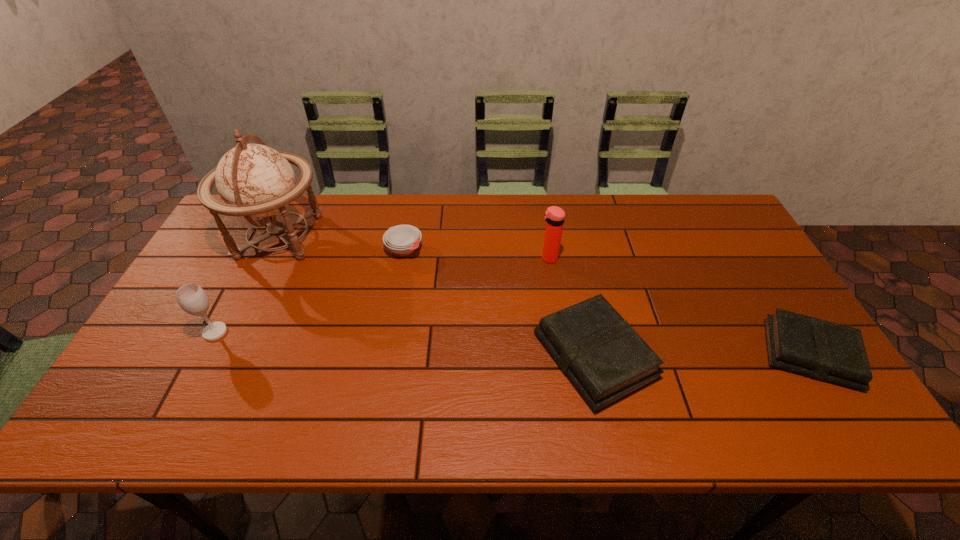
The height and width of the screenshot is (540, 960). I want to click on free space that satisfies the following two spatial constraints: 1. on the back side of the thermos bottle; 2. on the right side of the fourth shortest object, so click(x=253, y=259).

At what (x,y) coordinates should I click in order to perform the action: click on free point that satisfies the following two spatial constraints: 1. on the back side of the taller book; 2. at the front of the globe showing Africa. Please return your answer as a coordinate pair (x, y). The image size is (960, 540). Looking at the image, I should click on (569, 237).